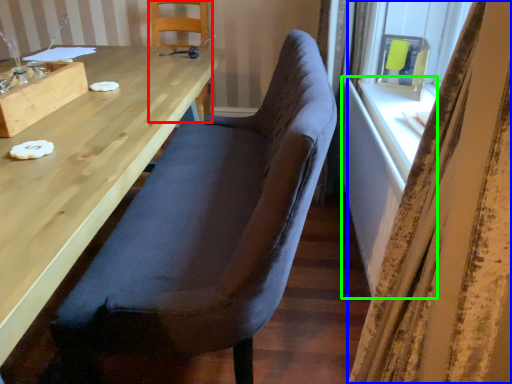
Question: Considering the real-world distances, which object is closest to chair (highlighted by a red box)? curtain (highlighted by a blue box) or table (highlighted by a green box).

Choices:
 (A) curtain
 (B) table

Answer: (B)